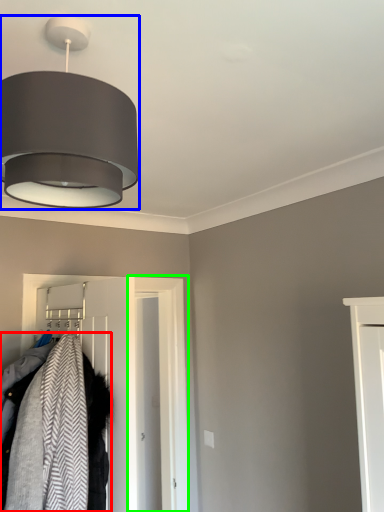
Question: Which is farther away from laundry (highlighted by a red box)? lamp (highlighted by a blue box) or door (highlighted by a green box)?

Choices:
 (A) lamp
 (B) door

Answer: (B)